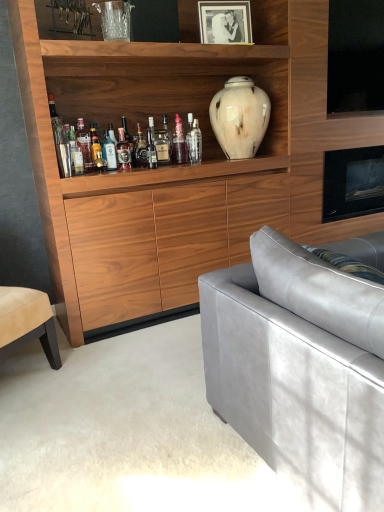
This screenshot has width=384, height=512. Find the location of `black glass fireplace at upper right`. black glass fireplace at upper right is located at coordinates 353,183.

Describe the element at coordinates (353, 183) in the screenshot. The image size is (384, 512). I see `black glass fireplace at upper right` at that location.

Image resolution: width=384 pixels, height=512 pixels. What do you see at coordinates (300, 368) in the screenshot?
I see `suede gray couch at right` at bounding box center [300, 368].

I want to click on translucent glass bottle at center, which is the 9th bottle in right-to-left order, so click(x=75, y=154).

Where is `shiny dark brown bottle at center, acting as the fifth bottle starting from the right`? The image size is (384, 512). shiny dark brown bottle at center, acting as the fifth bottle starting from the right is located at coordinates (140, 148).

The image size is (384, 512). Describe the element at coordinates (140, 148) in the screenshot. I see `shiny dark brown bottle at center, acting as the fifth bottle starting from the right` at that location.

At what (x,y) coordinates should I click in order to perform the action: click on translucent glass bottle at shelf center, positioned as the eighth bottle in left-to-right order. Please return your answer as a coordinate pair (x, y). The height and width of the screenshot is (512, 384). Looking at the image, I should click on (179, 142).

Identify the location of matte glass bottle at center, the seventh bottle from the right. This screenshot has height=512, width=384. (109, 152).

Describe the element at coordinates (109, 152) in the screenshot. I see `matte glass bottle at center, acting as the third bottle starting from the left` at that location.

Where is `black glass fireplace at upper right`? black glass fireplace at upper right is located at coordinates (353, 183).

In the scene shown: Considering the relative sizes of clear glass bottle at center, which is the first bottle from right to left, and translucent glass bottle at shelf center, acting as the eighth bottle starting from the right, in the image provided, is clear glass bottle at center, which is the first bottle from right to left, taller than translucent glass bottle at shelf center, acting as the eighth bottle starting from the right,?

Incorrect, the height of clear glass bottle at center, which is the first bottle from right to left, is not larger of that of translucent glass bottle at shelf center, acting as the eighth bottle starting from the right.

Is the depth of clear glass bottle at center, placed as the 9th bottle when sorted from left to right, less than that of translucent glass bottle at shelf center, acting as the eighth bottle starting from the right?

That is False.

Does clear glass bottle at center, placed as the 9th bottle when sorted from left to right, touch translucent glass bottle at shelf center, which is the second bottle from left to right?

No, clear glass bottle at center, placed as the 9th bottle when sorted from left to right, is not next to translucent glass bottle at shelf center, which is the second bottle from left to right.

I want to click on the 4th bottle in front of the shiny brown bottle at center, marked as the 4th bottle in a left-to-right arrangement, counting from the anchor's position, so click(x=75, y=154).

From a real-world perspective, which object stands above the other?

translucent glass bottle at center, which is the 9th bottle in right-to-left order, from a real-world perspective.

Considering the relative sizes of translucent glass bottle at center, which is counted as the 1th bottle, starting from the left, and shiny brown bottle at center, acting as the sixth bottle starting from the right, in the image provided, is translucent glass bottle at center, which is counted as the 1th bottle, starting from the left, taller than shiny brown bottle at center, acting as the sixth bottle starting from the right,?

Correct, translucent glass bottle at center, which is counted as the 1th bottle, starting from the left, is much taller as shiny brown bottle at center, acting as the sixth bottle starting from the right.

Considering the positions of point (73, 140) and point (119, 151), is point (73, 140) closer or farther from the camera than point (119, 151)?

Point (73, 140) is positioned closer to the camera compared to point (119, 151).

Which of these two, translucent glass bottle at shelf center, the 2th bottle in the right-to-left sequence, or shiny brown bottle at center, acting as the sixth bottle starting from the right, is bigger?

translucent glass bottle at shelf center, the 2th bottle in the right-to-left sequence, is bigger.

Looking at this image, considering the relative sizes of translucent glass bottle at shelf center, positioned as the eighth bottle in left-to-right order, and shiny brown bottle at center, acting as the sixth bottle starting from the right, in the image provided, is translucent glass bottle at shelf center, positioned as the eighth bottle in left-to-right order, shorter than shiny brown bottle at center, acting as the sixth bottle starting from the right,?

No.

From a real-world perspective, between translucent glass bottle at shelf center, the 2th bottle in the right-to-left sequence, and shiny brown bottle at center, acting as the sixth bottle starting from the right, who is vertically higher?

translucent glass bottle at shelf center, the 2th bottle in the right-to-left sequence.

Is there a large distance between black glass fireplace at upper right and suede gray couch at right?

Yes, black glass fireplace at upper right and suede gray couch at right are quite far apart.

Considering the positions of objects black glass fireplace at upper right and suede gray couch at right in the image provided, who is more to the left, black glass fireplace at upper right or suede gray couch at right?

From the viewer's perspective, suede gray couch at right appears more on the left side.

Is black glass fireplace at upper right facing towards suede gray couch at right?

No.

Is point (153, 153) positioned behind point (123, 155)?

No.

From a real-world perspective, is shiny silver bottle at center, which is the sixth bottle in left-to-right order, physically below shiny brown bottle at center, marked as the 4th bottle in a left-to-right arrangement?

Indeed, from a real-world perspective, shiny silver bottle at center, which is the sixth bottle in left-to-right order, is positioned beneath shiny brown bottle at center, marked as the 4th bottle in a left-to-right arrangement.

Is shiny silver bottle at center, which is the sixth bottle in left-to-right order, inside the boundaries of shiny brown bottle at center, acting as the sixth bottle starting from the right, or outside?

shiny silver bottle at center, which is the sixth bottle in left-to-right order, exists outside the volume of shiny brown bottle at center, acting as the sixth bottle starting from the right.

The image size is (384, 512). What are the coordinates of `bottle that is the 1st object directly below the shiny brown bottle at center, acting as the sixth bottle starting from the right (from a real-world perspective)` in the screenshot? It's located at (151, 146).

Is shiny dark brown bottle at center, acting as the fifth bottle starting from the right, oriented towards matte glass bottle at center, the seventh bottle from the right?

No, shiny dark brown bottle at center, acting as the fifth bottle starting from the right, is not turned towards matte glass bottle at center, the seventh bottle from the right.

Between shiny dark brown bottle at center, the 5th bottle positioned from the left, and matte glass bottle at center, acting as the third bottle starting from the left, which one appears on the left side from the viewer's perspective?

matte glass bottle at center, acting as the third bottle starting from the left, is more to the left.

Which is in front, point (199, 163) or point (119, 156)?

Point (119, 156)

Considering the sizes of objects clear glass bottle at center, placed as the 9th bottle when sorted from left to right, and shiny brown bottle at center, acting as the sixth bottle starting from the right, in the image provided, who is smaller, clear glass bottle at center, placed as the 9th bottle when sorted from left to right, or shiny brown bottle at center, acting as the sixth bottle starting from the right,?

With smaller size is shiny brown bottle at center, acting as the sixth bottle starting from the right.

Who is more distant, clear glass bottle at center, placed as the 9th bottle when sorted from left to right, or shiny brown bottle at center, marked as the 4th bottle in a left-to-right arrangement?

clear glass bottle at center, placed as the 9th bottle when sorted from left to right, is behind.

Is shiny brown bottle at center, marked as the 4th bottle in a left-to-right arrangement, surrounded by clear glass bottle at center, placed as the 9th bottle when sorted from left to right?

No, shiny brown bottle at center, marked as the 4th bottle in a left-to-right arrangement, is not a part of clear glass bottle at center, placed as the 9th bottle when sorted from left to right.

From a real-world perspective, which bottle is the 2nd one underneath the clear glass bottle at center, which is the first bottle from right to left? Please provide its 2D coordinates.

[(84, 146)]

The image size is (384, 512). There is a translucent glass bottle at center, which is counted as the 1th bottle, starting from the left. Find the location of `the 4th bottle above it (from the image's perspective)`. the 4th bottle above it (from the image's perspective) is located at coordinates (123, 151).

Considering their positions, is translucent glass bottle at center, placed as the 7th bottle when sorted from left to right, positioned closer to shiny dark brown bottle at center, the 5th bottle positioned from the left, than shiny brown bottle at center, acting as the sixth bottle starting from the right?

Among the two, shiny brown bottle at center, acting as the sixth bottle starting from the right, is located nearer to shiny dark brown bottle at center, the 5th bottle positioned from the left.

Considering their positions, is translucent glass bottle at shelf center, positioned as the eighth bottle in left-to-right order, positioned further to black matte photo frame at upper center than shiny dark brown bottle at center, acting as the fifth bottle starting from the right?

The object further to black matte photo frame at upper center is shiny dark brown bottle at center, acting as the fifth bottle starting from the right.

From the image, which object appears to be farther from shiny brown bottle at center, marked as the 4th bottle in a left-to-right arrangement, translucent glass bottle at center or translucent glass bottle at shelf center, the 2th bottle in the right-to-left sequence?

translucent glass bottle at shelf center, the 2th bottle in the right-to-left sequence, is further to shiny brown bottle at center, marked as the 4th bottle in a left-to-right arrangement.

Looking at the image, which one is located further to shiny silver bottle at center, which is the sixth bottle in left-to-right order, translucent glass bottle at center, placed as the 3th bottle when sorted from right to left, or translucent glass bottle at center?

translucent glass bottle at center, placed as the 3th bottle when sorted from right to left, is positioned further to the anchor shiny silver bottle at center, which is the sixth bottle in left-to-right order.

From the image, which object appears to be farther from translucent glass bottle at center, which is counted as the 1th bottle, starting from the left, wooden cupboard at center or shiny brown bottle at center, marked as the 4th bottle in a left-to-right arrangement?

Among the two, wooden cupboard at center is located further to translucent glass bottle at center, which is counted as the 1th bottle, starting from the left.

Based on their spatial positions, is clear glass bottle at center, which is the first bottle from right to left, or translucent glass bottle at center, placed as the 3th bottle when sorted from right to left, further from white marble vase at upper center?

translucent glass bottle at center, placed as the 3th bottle when sorted from right to left, is further to white marble vase at upper center.

From the image, which object appears to be farther from translucent glass bottle at center, which is the 9th bottle in right-to-left order, matte glass bottle at center, the seventh bottle from the right, or clear glass bottle at center, which is the first bottle from right to left?

clear glass bottle at center, which is the first bottle from right to left.

Based on their spatial positions, is shiny silver bottle at center, which ranks as the 4th bottle in right-to-left order, or black glass fireplace at upper right further from shiny dark brown bottle at center, acting as the fifth bottle starting from the right?

black glass fireplace at upper right.

Identify the location of vase between shiny dark brown bottle at center, acting as the fifth bottle starting from the right, and wooden cupboard at center, in the horizontal direction. (240, 117).

In order to click on bottle between translucent glass bottle at center, placed as the 3th bottle when sorted from right to left, and clear glass bottle at center, placed as the 9th bottle when sorted from left to right, from left to right in this screenshot , I will do `click(179, 142)`.

This screenshot has height=512, width=384. I want to click on glass jar situated between shiny brown bottle at center, acting as the sixth bottle starting from the right, and clear glass bottle at center, which is the first bottle from right to left, from left to right, so click(162, 146).

Where is `glass jar between matte glass bottle at center, the seventh bottle from the right, and white marble vase at upper center`? The height and width of the screenshot is (512, 384). glass jar between matte glass bottle at center, the seventh bottle from the right, and white marble vase at upper center is located at coordinates (162, 146).